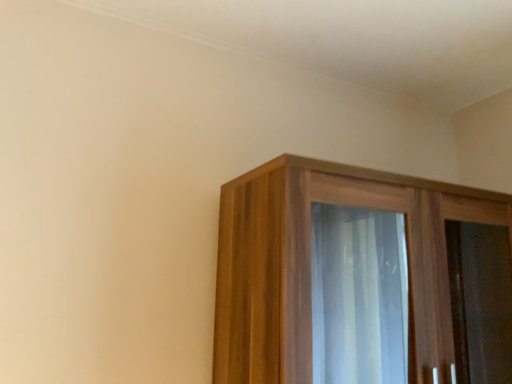
What do you see at coordinates (310, 262) in the screenshot? The image size is (512, 384). I see `wooden cabinet at right` at bounding box center [310, 262].

Identify the location of wooden cabinet at right. The height and width of the screenshot is (384, 512). point(310,262).

Locate an element on the screen. This screenshot has width=512, height=384. wooden cabinet at right is located at coordinates (310, 262).